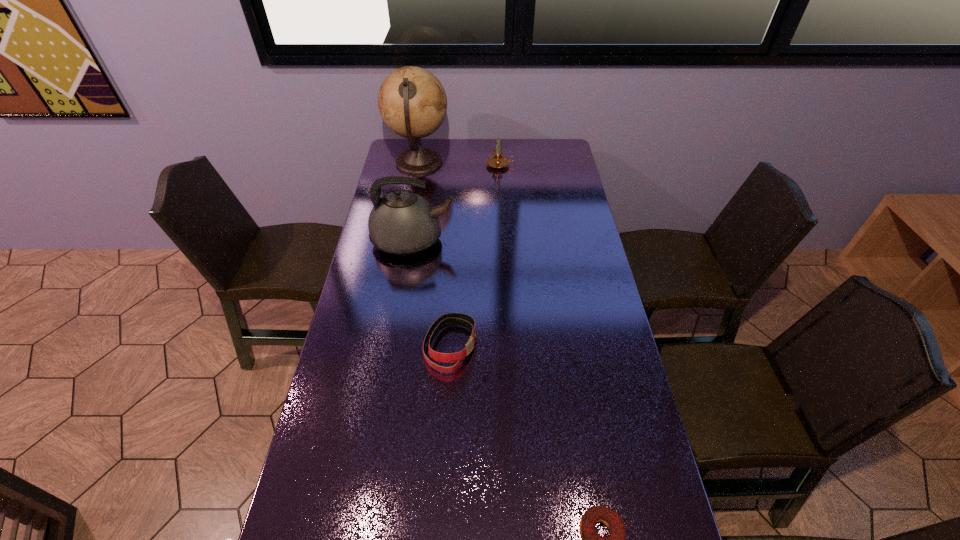
The width and height of the screenshot is (960, 540). Identify the location of free space that satisfies the following two spatial constraints: 1. on the front-facing side of the tallest object; 2. on the right side of the third tallest object. (419, 165).